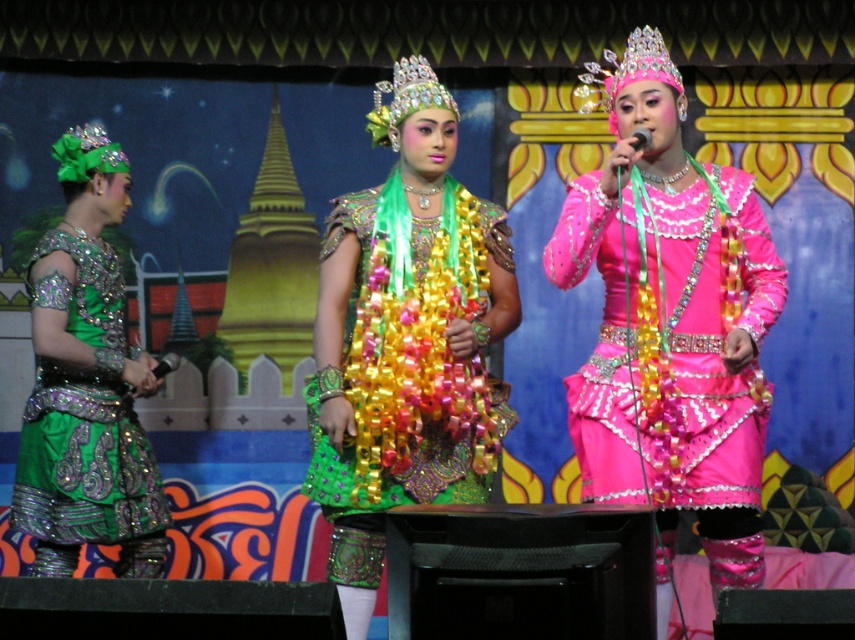
You are a photographer taking a photo of the stage. You notice the shiny green fabric dress at center and the green sequined dress at left. Which dress will appear more prominent in the photo?

The shiny green fabric dress at center will appear more prominent in the photo because it is positioned over the green sequined dress at left, making it stand out more.

Based on the scene description, which dress is positioned higher? The pink sequined dress at center or the green sequined dress at left?

The pink sequined dress at center is positioned higher than the green sequined dress at left according to the description.

You are a photographer positioned at the back of the stage. You want to capture a photo where both the pink sequined dress at center and the green sequined dress at left are fully visible. Given that your camera has a fixed focal length, which dress should you focus on to ensure both are in frame?

To ensure both the pink sequined dress at center and the green sequined dress at left are fully visible, you should focus on the pink sequined dress at center since it is wider and requires more space in the frame.